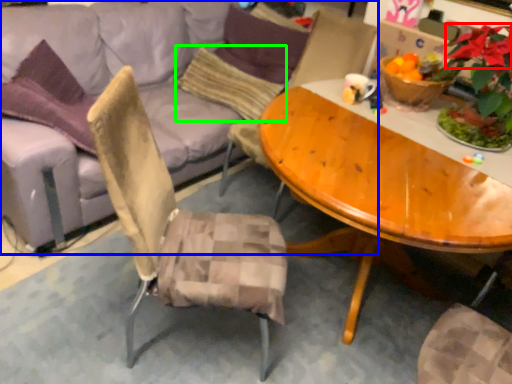
Question: Based on their relative distances, which object is nearer to flower (highlighted by a red box)? Choose from studio couch (highlighted by a blue box) and pillow (highlighted by a green box).

Choices:
 (A) studio couch
 (B) pillow

Answer: (B)